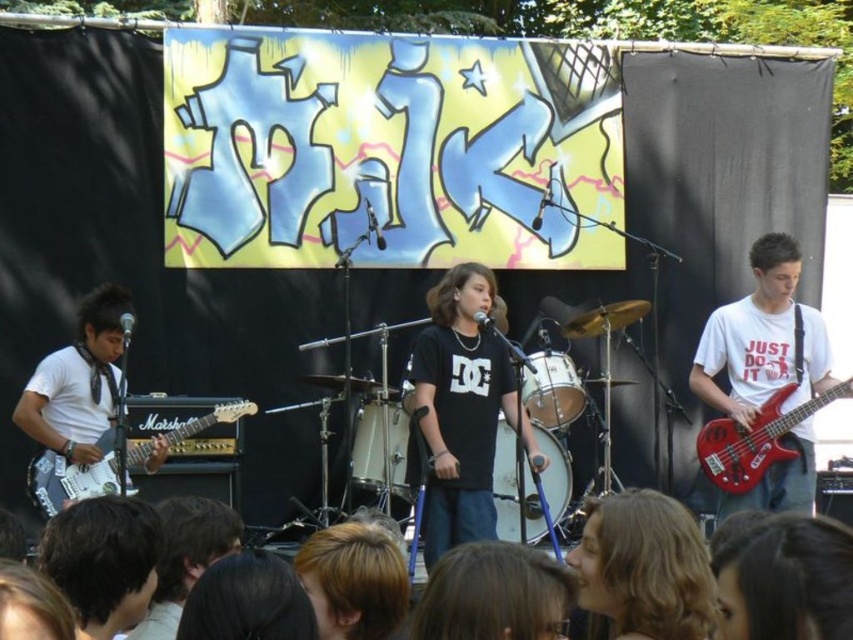
Question: Is red glossy bass guitar at right below shiny red electric bass at right?

Choices:
 (A) no
 (B) yes

Answer: (A)

Question: Which is farther from the white drum at center?

Choices:
 (A) shiny red electric bass at right
 (B) white matte guitar at left
 (C) silver metallic drum at center

Answer: (B)

Question: Is white matte guitar at left smaller than metallic silver drum at center?

Choices:
 (A) no
 (B) yes

Answer: (A)

Question: Which point appears farthest from the camera in this image?

Choices:
 (A) (560, 513)
 (B) (786, 362)
 (C) (167, 436)

Answer: (A)

Question: Which of the following is the farthest from the observer?

Choices:
 (A) (96, 468)
 (B) (378, 474)
 (C) (540, 364)
 (D) (757, 264)

Answer: (C)

Question: Considering the relative positions of white glossy marshall amplifier at lower left and silver metallic drum at center in the image provided, where is white glossy marshall amplifier at lower left located with respect to silver metallic drum at center?

Choices:
 (A) left
 (B) right

Answer: (A)